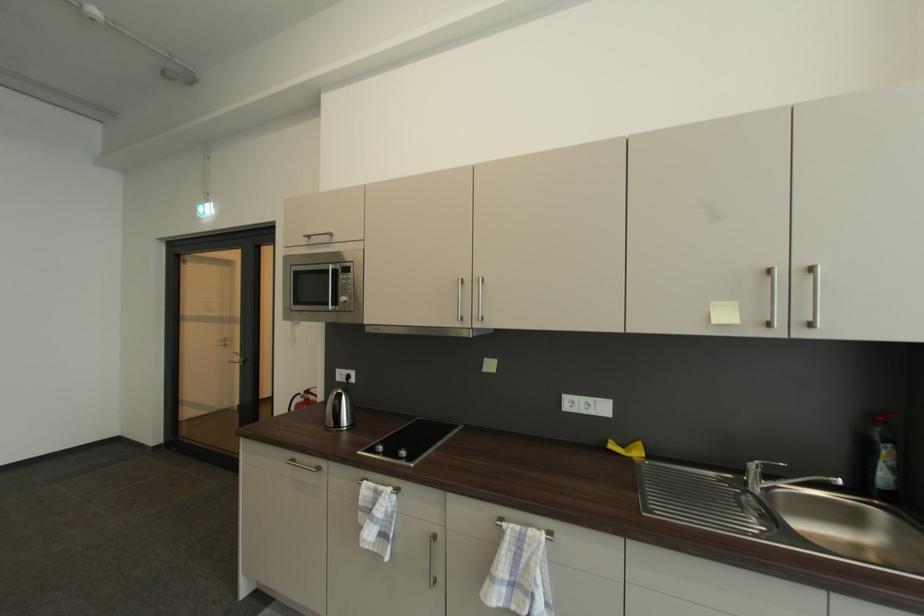
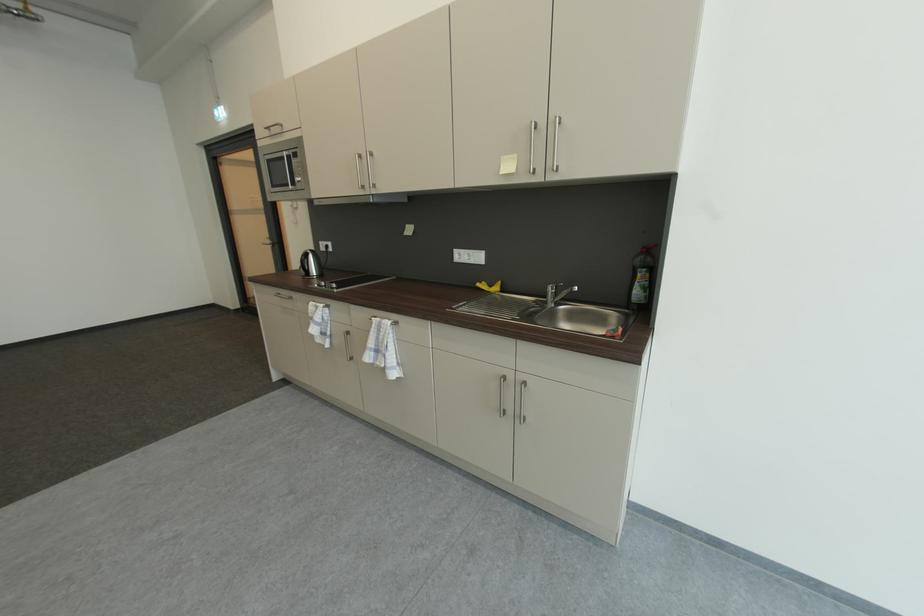
In the second image, find the point that corresponds to [344,403] in the first image.

(310, 259)